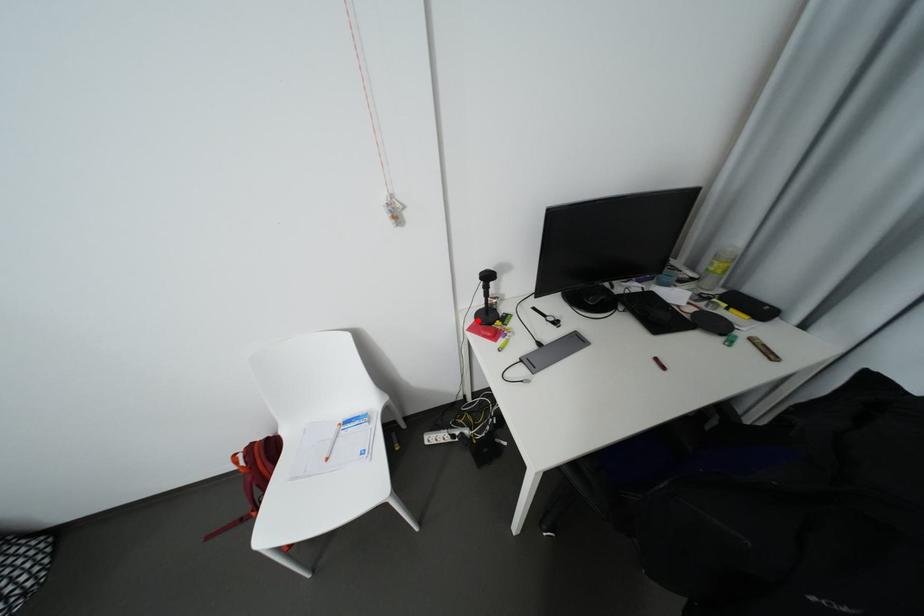
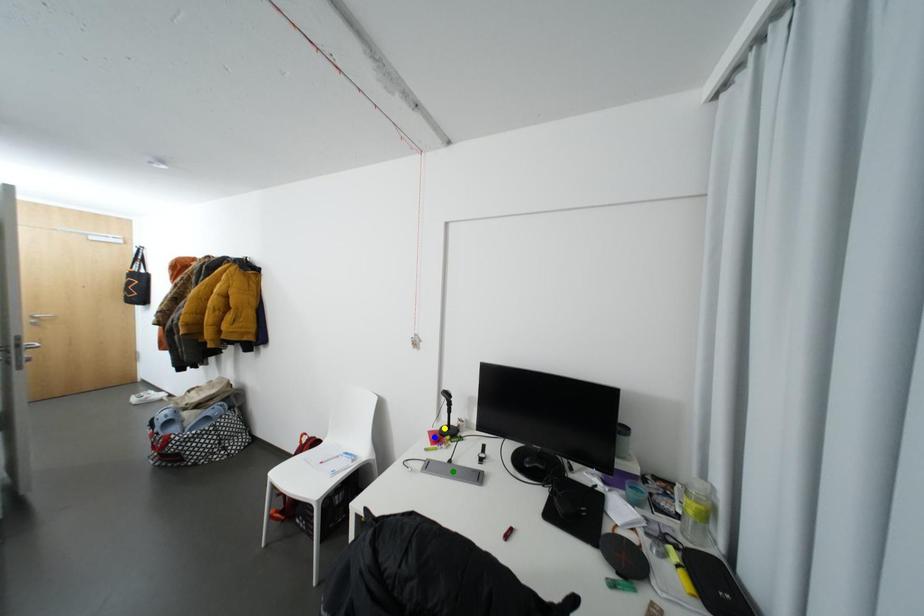
Question: I am providing you with two images of the same scene from different viewpoints. A red point is marked on the first image. You are given multiple points on the second image. Which point in image 2 is actually the same real-world point as the red point in image 1?

Choices:
 (A) yellow point
 (B) blue point
 (C) green point

Answer: (A)